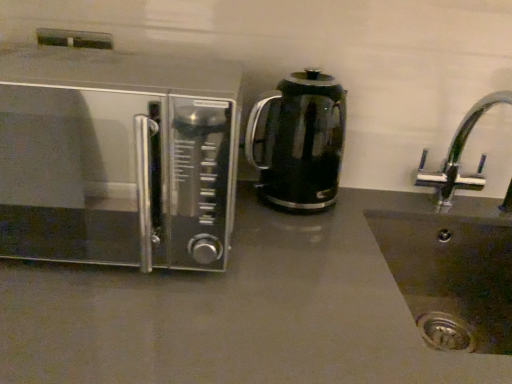
Image resolution: width=512 pixels, height=384 pixels. I want to click on vacant area situated below satin silver microwave at left (from a real-world perspective), so click(x=88, y=246).